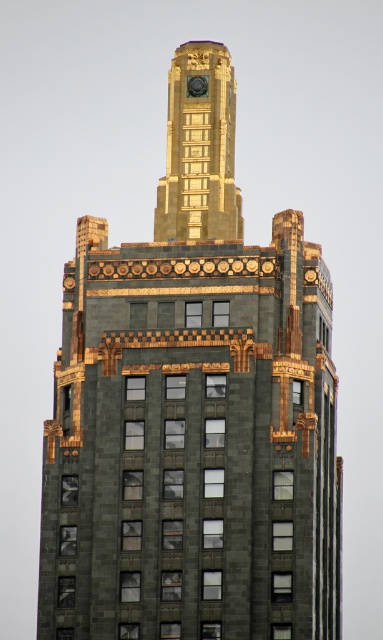
Does gold/golden metal clock tower at upper center have a lesser height compared to polished brass clock at upper center?

In fact, gold/golden metal clock tower at upper center may be taller than polished brass clock at upper center.

Is the position of gold/golden metal clock tower at upper center less distant than that of polished brass clock at upper center?

That is True.

Locate an element on the screen. gold/golden metal clock tower at upper center is located at coordinates (199, 150).